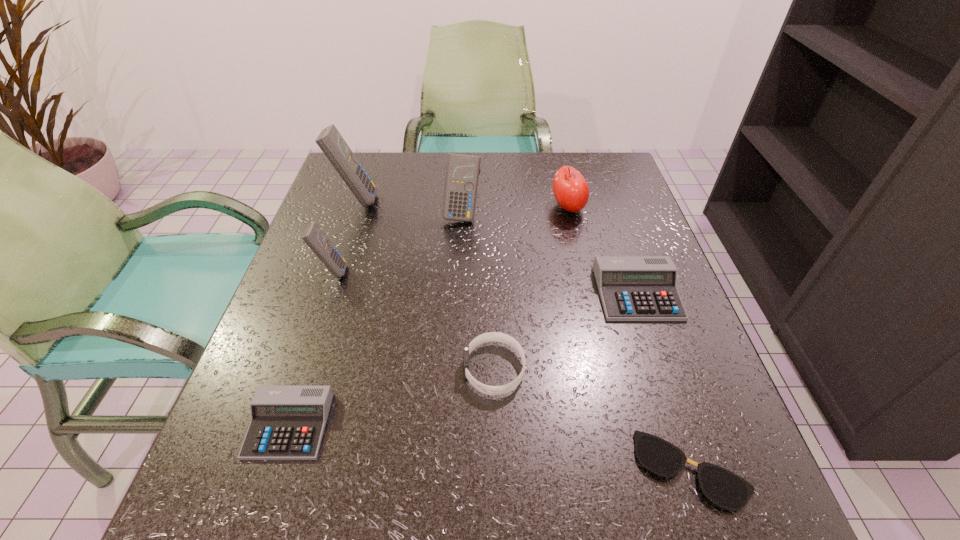
Locate an element on the screen. free space between the second biggest blue calculator and the apple is located at coordinates (516, 211).

Locate an element on the screen. vacant area that lies between the bigger gray calculator and the biggest blue calculator is located at coordinates (496, 247).

Find the location of a particular element. This screenshot has width=960, height=540. vacant space in between the tallest object and the third tallest calculator is located at coordinates (344, 235).

This screenshot has height=540, width=960. Identify the location of blank region between the shortest object and the apple. (630, 339).

Image resolution: width=960 pixels, height=540 pixels. Find the location of `vacant area that lies between the wristband and the smaller gray calculator`. vacant area that lies between the wristband and the smaller gray calculator is located at coordinates click(392, 397).

The height and width of the screenshot is (540, 960). In order to click on free space between the wristband and the seventh shortest object in this screenshot , I will do `click(478, 292)`.

The image size is (960, 540). In order to click on vacant region between the second shortest calculator and the second calculator from right to left in this screenshot , I will do `click(549, 254)`.

Locate an element on the screen. The height and width of the screenshot is (540, 960). the second closest object to the wristband is located at coordinates (632, 288).

What are the coordinates of `object that can be found as the fourth closest to the fourth shortest calculator` in the screenshot? It's located at (632, 288).

Identify which calculator is located as the third nearest to the rightmost calculator. Please provide its 2D coordinates. Your answer should be formatted as a tuple, i.e. [(x, y)], where the tuple contains the x and y coordinates of a point satisfying the conditions above.

[(313, 236)]